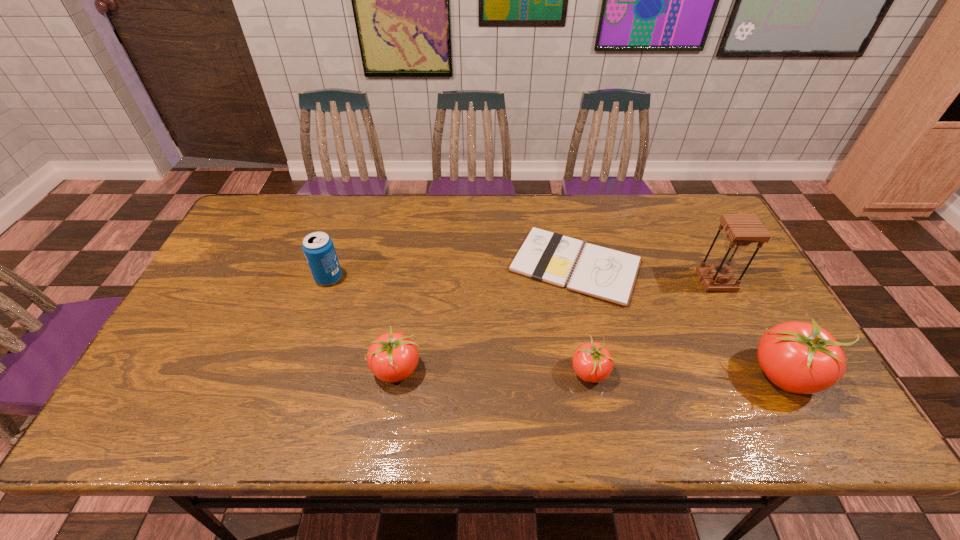
Please point a spot to add another tomato on the left. Please provide its 2D coordinates. Your answer should be formatted as a tuple, i.e. [(x, y)], where the tuple contains the x and y coordinates of a point satisfying the conditions above.

[(204, 367)]